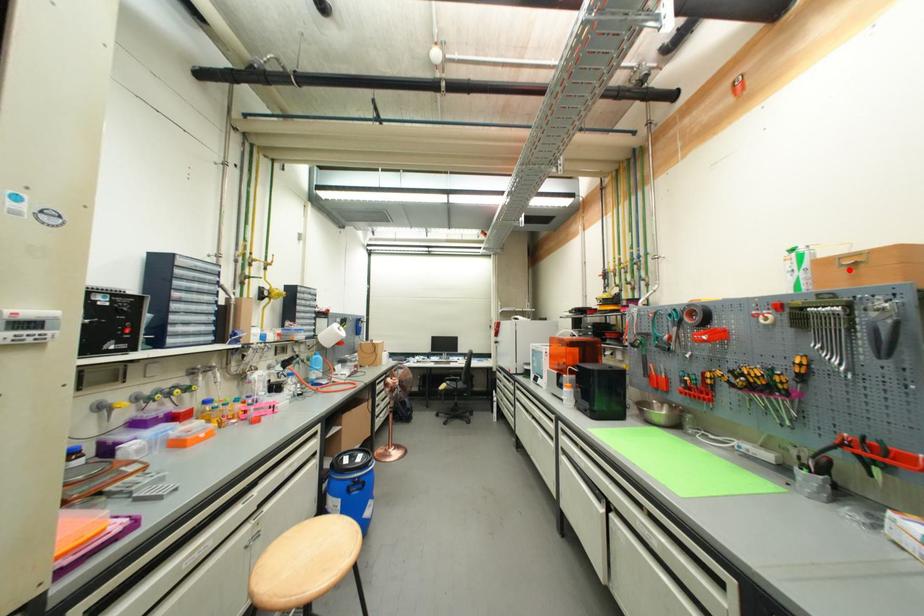
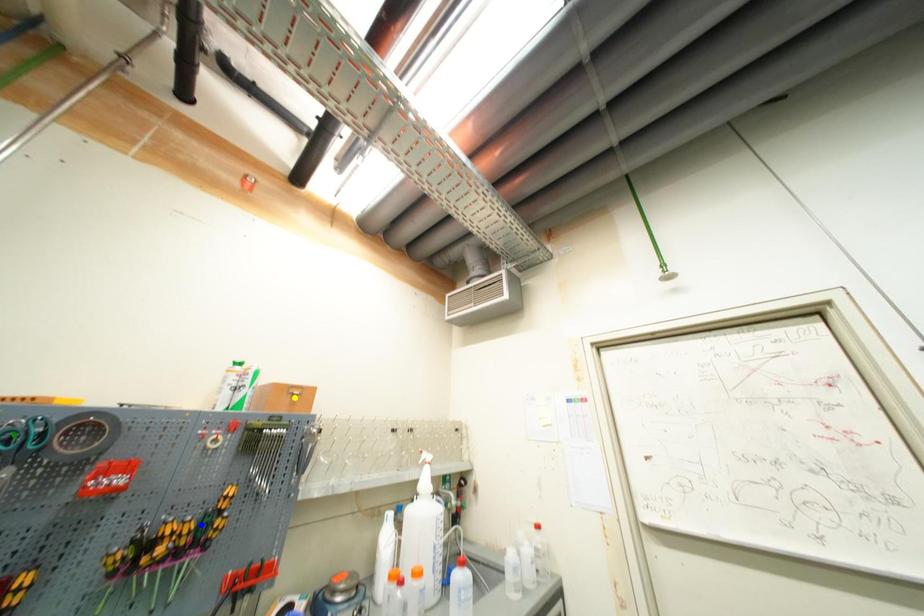
Question: I am providing you with two images of the same scene from different viewpoints. A red point is marked on the first image. You are given multiple points on the second image. Which point in image 2 represents the same 3d spot as the red point in image 1?

Choices:
 (A) blue point
 (B) green point
 (C) yellow point

Answer: (C)